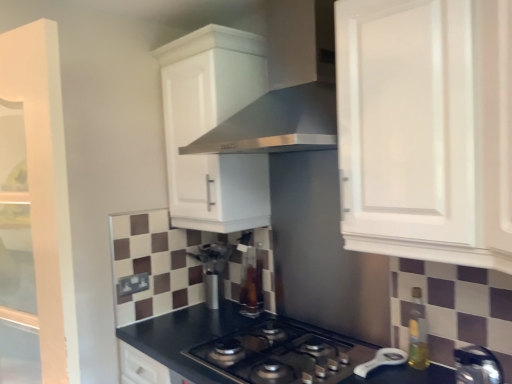
Question: Based on their positions, is satin silver vent at upper center located to the left or right of black matte gas stove at center?

Choices:
 (A) left
 (B) right

Answer: (B)

Question: Relative to black matte gas stove at center, is satin silver vent at upper center in front or behind?

Choices:
 (A) front
 (B) behind

Answer: (A)

Question: Which object is the farthest from the satin silver vent at upper center?

Choices:
 (A) satin silver coffee machine at center
 (B) black matte gas stove at center
 (C) white matte cabinet at upper right, positioned as the second cabinetry in back-to-front order
 (D) metallic silver kettle at lower right, the 2th appliance when ordered from left to right
 (E) translucent amber bottle at right

Answer: (D)

Question: Which object is the farthest from the black matte gas stove at center?

Choices:
 (A) translucent amber bottle at right
 (B) satin silver coffee machine at center
 (C) white matte cabinet at upper center, which appears as the first cabinetry when viewed from the left
 (D) black matte countertop at center
 (E) satin silver vent at upper center

Answer: (E)